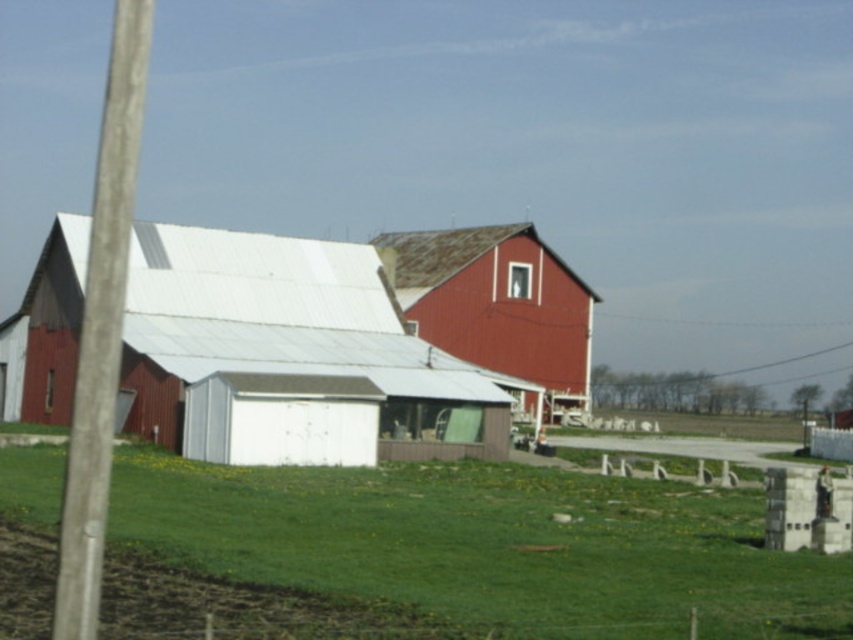
You are standing in a field and want to reach the smooth red barn at center. If you can walk 300 feet in 10 minutes, how long will it take you to reach the barn?

The smooth red barn at center is 226.41 feet away. Since you can walk 300 feet in 10 minutes, it will take approximately 7.5 minutes to reach the barn.

You are standing in the middle of the farm scene and want to walk towards the two points marked in the image. Which point would you reach first, point (172,308) or point (115,76)?

You would reach point (172,308) first because it is closer to you than point (115,76), which is further away.

You are standing behind a wooden post and looking at the smooth red barn at center and the smooth gray pole at left. Which object is closer to your right side?

The smooth red barn at center is positioned on the right side of smooth gray pole at left, so the smooth red barn at center is closer to your right side.